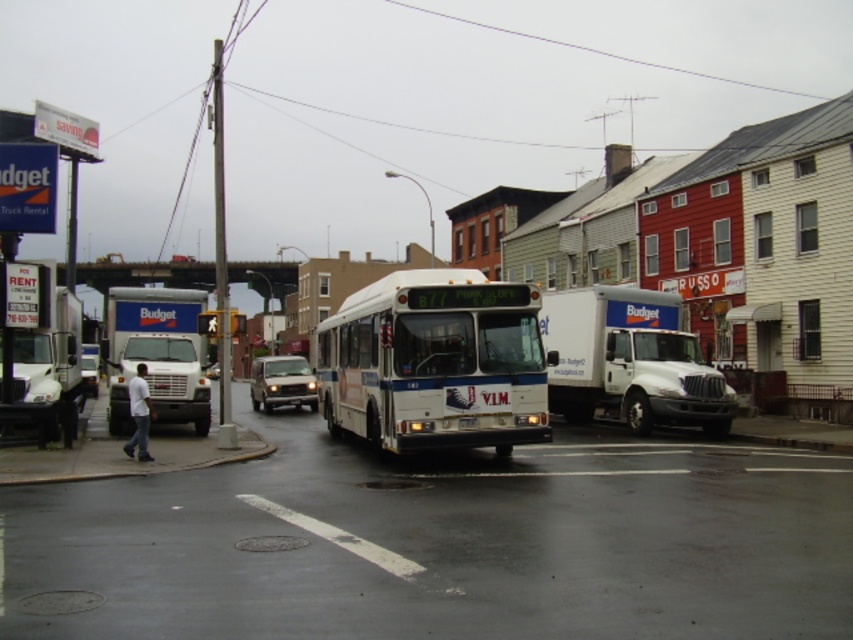
Is white glossy bus at center to the left of metallic silver suv at center from the viewer's perspective?

Incorrect, white glossy bus at center is not on the left side of metallic silver suv at center.

Which is behind, point (368, 376) or point (254, 369)?

Positioned behind is point (254, 369).

Where is `white glossy bus at center`? Image resolution: width=853 pixels, height=640 pixels. white glossy bus at center is located at coordinates (434, 362).

Is point (44, 321) farther from viewer compared to point (469, 422)?

Yes, it is.

Does white plastic sign at upper left lie behind white plastic license plate at center?

That is True.

Is point (73, 198) closer to camera compared to point (476, 420)?

No, (73, 198) is behind (476, 420).

Identify the location of white plastic sign at upper left. Image resolution: width=853 pixels, height=640 pixels. (39, 269).

Looking at this image, can you confirm if white plastic sign at upper left is thinner than metallic silver suv at center?

In fact, white plastic sign at upper left might be wider than metallic silver suv at center.

The height and width of the screenshot is (640, 853). Describe the element at coordinates (39, 269) in the screenshot. I see `white plastic sign at upper left` at that location.

You are a GUI agent. You are given a task and a screenshot of the screen. Output one action in this format:
    pyautogui.click(x=<x>, y=<y>)
    Task: Click on the white plastic sign at upper left
    
    Given the screenshot: What is the action you would take?
    pyautogui.click(x=39, y=269)